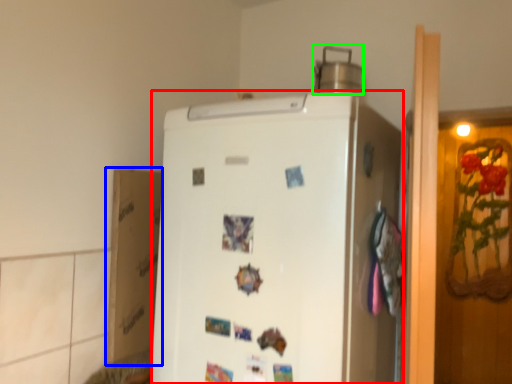
Question: Which object is the farthest from refrigerator (highlighted by a red box)? Choose among these: cardboard box (highlighted by a blue box) or appliance (highlighted by a green box).

Choices:
 (A) cardboard box
 (B) appliance

Answer: (B)